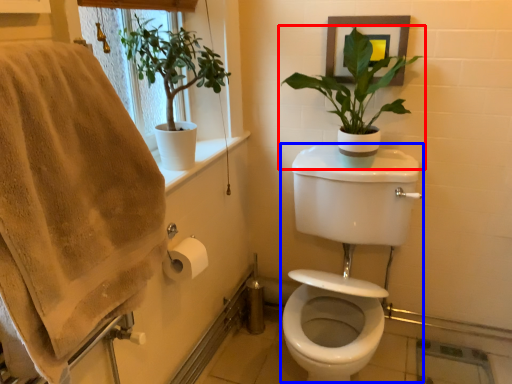
Question: Among these objects, which one is farthest to the camera, houseplant (highlighted by a red box) or sink (highlighted by a blue box)?

Choices:
 (A) houseplant
 (B) sink

Answer: (A)